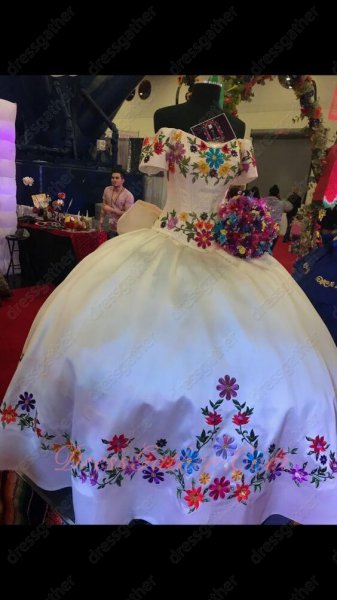
This screenshot has width=337, height=600. I want to click on sitting chair, so click(x=14, y=241).